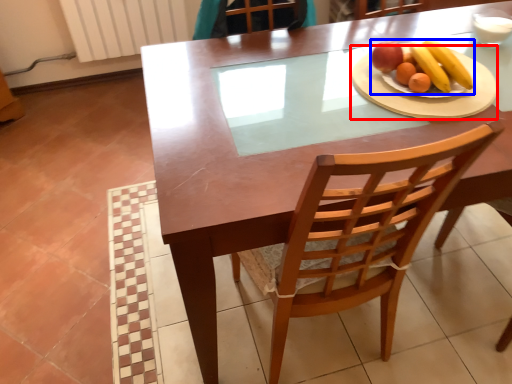
Question: Among these objects, which one is nearest to the camera, platter (highlighted by a red box) or fruit dish (highlighted by a blue box)?

Choices:
 (A) platter
 (B) fruit dish

Answer: (A)